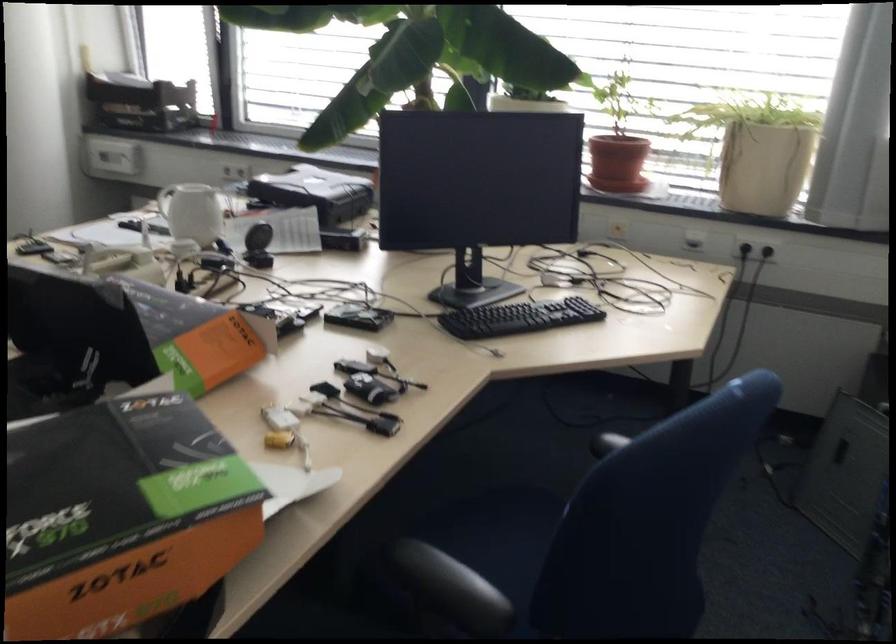
Image resolution: width=896 pixels, height=644 pixels. What do you see at coordinates (498, 535) in the screenshot?
I see `the blue chair sitting surface` at bounding box center [498, 535].